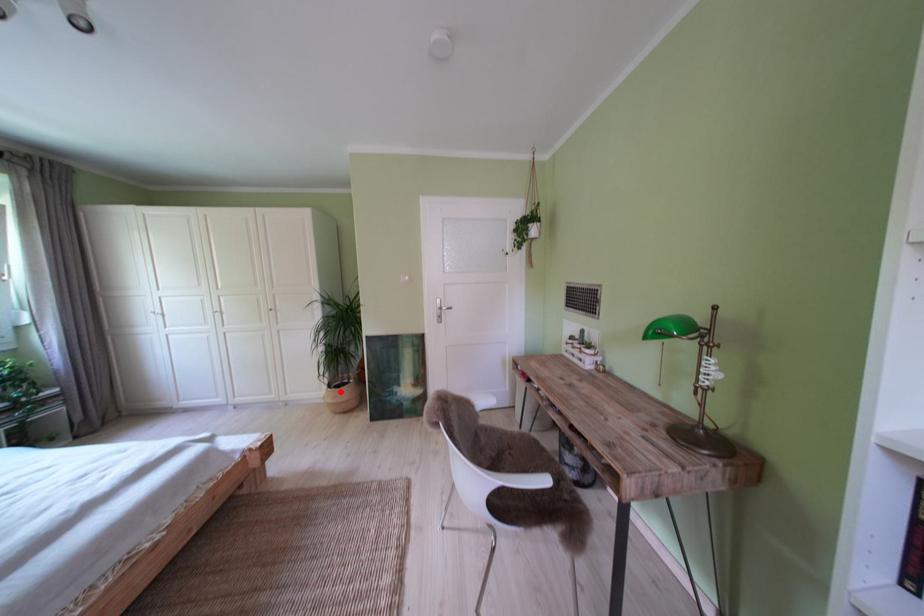
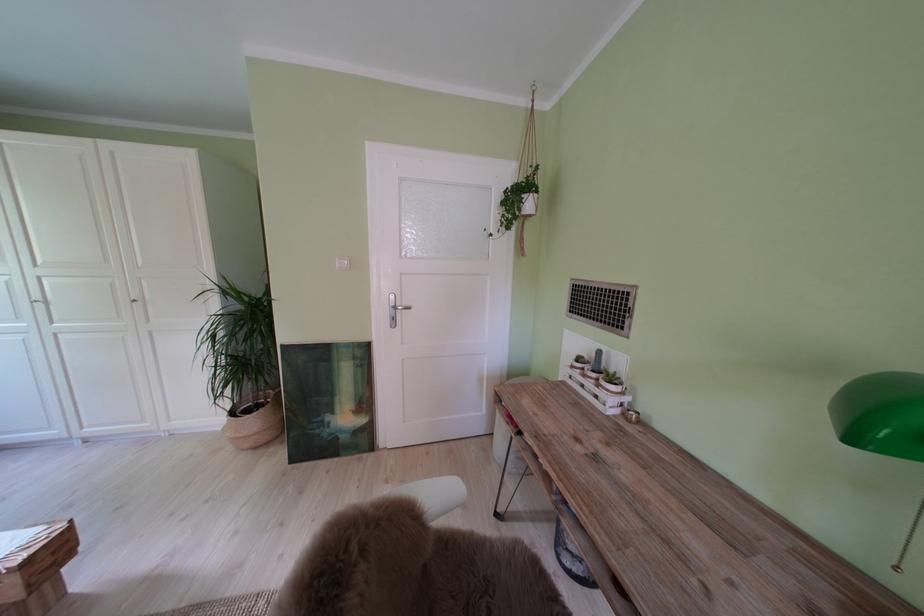
Question: I am providing you with two images of the same scene from different viewpoints. In image1, a red point is highlighted. Considering the same 3D point in image2, which of the following is correct?

Choices:
 (A) It is closer
 (B) It is farther

Answer: (B)